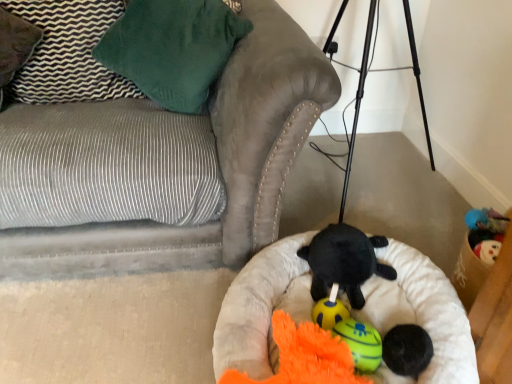
What do you see at coordinates (344, 261) in the screenshot? I see `black plush turtle at center, which is the 2th toy from back to front` at bounding box center [344, 261].

What do you see at coordinates (329, 310) in the screenshot?
I see `rubber ball at center, arranged as the first toy when viewed from the back` at bounding box center [329, 310].

Consider the image. Measure the distance between point (57, 141) and camera.

4.01 feet.

Where is `orange fuzzy toy at center, arranged as the 5th toy when viewed from the back`? Image resolution: width=512 pixels, height=384 pixels. orange fuzzy toy at center, arranged as the 5th toy when viewed from the back is located at coordinates (304, 357).

Locate an element on the screen. soft black ball at center, which is the 4th toy from back to front is located at coordinates (407, 349).

How much distance is there between green soft pillow at upper left, which appears as the first pillow when viewed from the right, and orange plush toy at center, the 3th toy in the front-to-back sequence?

They are 1.01 meters apart.

Which object is positioned more to the left, green soft pillow at upper left, which appears as the first pillow when viewed from the right, or orange plush toy at center, the 3th toy in the front-to-back sequence?

Positioned to the left is green soft pillow at upper left, which appears as the first pillow when viewed from the right.

Does green soft pillow at upper left, which appears as the 2th pillow when viewed from the left, contain orange plush toy at center, placed as the 3th toy when sorted from back to front?

No.

Considering the relative sizes of green soft pillow at upper left, which appears as the first pillow when viewed from the right, and orange plush toy at center, placed as the 3th toy when sorted from back to front, in the image provided, is green soft pillow at upper left, which appears as the first pillow when viewed from the right, taller than orange plush toy at center, placed as the 3th toy when sorted from back to front,?

Indeed, green soft pillow at upper left, which appears as the first pillow when viewed from the right, has a greater height compared to orange plush toy at center, placed as the 3th toy when sorted from back to front.

Does rubber ball at center, arranged as the first toy when viewed from the back, come behind soft black ball at center, which is the 4th toy from back to front?

Yes, rubber ball at center, arranged as the first toy when viewed from the back, is further from the camera.

Which is correct: rubber ball at center, arranged as the first toy when viewed from the back, is inside soft black ball at center, the 2th toy when ordered from front to back, or outside of it?

rubber ball at center, arranged as the first toy when viewed from the back, is outside soft black ball at center, the 2th toy when ordered from front to back.

Can you confirm if rubber ball at center, arranged as the first toy when viewed from the back, is shorter than soft black ball at center, the 2th toy when ordered from front to back?

Correct, rubber ball at center, arranged as the first toy when viewed from the back, is not as tall as soft black ball at center, the 2th toy when ordered from front to back.

From the image's perspective, which one is positioned lower, rubber ball at center, which appears as the fifth toy when viewed from the front, or soft black ball at center, which is the 4th toy from back to front?

soft black ball at center, which is the 4th toy from back to front, is shown below in the image.

Is point (37, 58) closer to camera compared to point (294, 336)?

No, (37, 58) is behind (294, 336).

Which of these two, velvet green pillow at upper left, placed as the 2th pillow when sorted from right to left, or orange fuzzy toy at center, the first toy in the front-to-back sequence, is bigger?

velvet green pillow at upper left, placed as the 2th pillow when sorted from right to left, is bigger.

Do you think velvet green pillow at upper left, which is the first pillow in left-to-right order, is within orange fuzzy toy at center, the first toy in the front-to-back sequence, or outside of it?

velvet green pillow at upper left, which is the first pillow in left-to-right order, lies outside orange fuzzy toy at center, the first toy in the front-to-back sequence.

From a real-world perspective, which is physically below, orange fuzzy toy at center, arranged as the 5th toy when viewed from the back, or velvet green pillow at upper left, placed as the 2th pillow when sorted from right to left?

In real-world perspective, orange fuzzy toy at center, arranged as the 5th toy when viewed from the back, is lower.

Considering the sizes of orange fuzzy toy at center, the first toy in the front-to-back sequence, and velvet green pillow at upper left, placed as the 2th pillow when sorted from right to left, in the image, is orange fuzzy toy at center, the first toy in the front-to-back sequence, bigger or smaller than velvet green pillow at upper left, placed as the 2th pillow when sorted from right to left,?

In the image, orange fuzzy toy at center, the first toy in the front-to-back sequence, appears to be smaller than velvet green pillow at upper left, placed as the 2th pillow when sorted from right to left.

Considering the relative positions of orange fuzzy toy at center, arranged as the 5th toy when viewed from the back, and velvet green pillow at upper left, placed as the 2th pillow when sorted from right to left, in the image provided, is orange fuzzy toy at center, arranged as the 5th toy when viewed from the back, to the left of velvet green pillow at upper left, placed as the 2th pillow when sorted from right to left, from the viewer's perspective?

No.

Based on the photo, who is taller, orange fuzzy toy at center, arranged as the 5th toy when viewed from the back, or velvet green pillow at upper left, which is the first pillow in left-to-right order?

Standing taller between the two is velvet green pillow at upper left, which is the first pillow in left-to-right order.

Could you tell me if soft beige dog bed at center is facing orange fuzzy toy at center, arranged as the 5th toy when viewed from the back?

Yes, soft beige dog bed at center is turned towards orange fuzzy toy at center, arranged as the 5th toy when viewed from the back.

Can you confirm if soft beige dog bed at center is shorter than orange fuzzy toy at center, the first toy in the front-to-back sequence?

No, soft beige dog bed at center is not shorter than orange fuzzy toy at center, the first toy in the front-to-back sequence.

Is soft beige dog bed at center wider than orange fuzzy toy at center, arranged as the 5th toy when viewed from the back?

Correct, the width of soft beige dog bed at center exceeds that of orange fuzzy toy at center, arranged as the 5th toy when viewed from the back.

Considering the relative sizes of green soft pillow at upper left, which appears as the 2th pillow when viewed from the left, and orange fuzzy toy at center, the first toy in the front-to-back sequence, in the image provided, is green soft pillow at upper left, which appears as the 2th pillow when viewed from the left, taller than orange fuzzy toy at center, the first toy in the front-to-back sequence,?

Indeed, green soft pillow at upper left, which appears as the 2th pillow when viewed from the left, has a greater height compared to orange fuzzy toy at center, the first toy in the front-to-back sequence.

Which object is wider, green soft pillow at upper left, which appears as the first pillow when viewed from the right, or orange fuzzy toy at center, the first toy in the front-to-back sequence?

green soft pillow at upper left, which appears as the first pillow when viewed from the right.

From the image's perspective, who appears lower, green soft pillow at upper left, which appears as the first pillow when viewed from the right, or orange fuzzy toy at center, arranged as the 5th toy when viewed from the back?

From the image's view, orange fuzzy toy at center, arranged as the 5th toy when viewed from the back, is below.

Is green soft pillow at upper left, which appears as the first pillow when viewed from the right, oriented towards orange fuzzy toy at center, the first toy in the front-to-back sequence?

No, green soft pillow at upper left, which appears as the first pillow when viewed from the right, is not aimed at orange fuzzy toy at center, the first toy in the front-to-back sequence.

Between black plush turtle at center, which is the 2th toy from back to front, and soft beige dog bed at center, which one has larger width?

Wider between the two is soft beige dog bed at center.

From a real-world perspective, is black plush turtle at center, positioned as the fourth toy in front-to-back order, on top of soft beige dog bed at center?

Yes.

Considering the points (370, 260) and (277, 250), which point is behind, point (370, 260) or point (277, 250)?

The point (277, 250) is farther from the camera.

Find the location of a particular element. The width and height of the screenshot is (512, 384). the 4th toy below when counting from the green soft pillow at upper left, which appears as the first pillow when viewed from the right (from the image's perspective) is located at coordinates (361, 343).

This screenshot has height=384, width=512. What are the coordinates of `the 1st toy above the soft black ball at center, which is the 4th toy from back to front (from the image's perspective)` in the screenshot? It's located at (329, 310).

Considering their positions, is orange plush toy at center, placed as the 3th toy when sorted from back to front, positioned further to suede gray couch at lower left than green soft pillow at upper left, which appears as the first pillow when viewed from the right?

orange plush toy at center, placed as the 3th toy when sorted from back to front.

Looking at the image, which one is located further to orange plush toy at center, the 3th toy in the front-to-back sequence, rubber ball at center, which appears as the fifth toy when viewed from the front, or suede gray couch at lower left?

suede gray couch at lower left.

Estimate the real-world distances between objects in this image. Which object is further from rubber ball at center, arranged as the first toy when viewed from the back, velvet green pillow at upper left, placed as the 2th pillow when sorted from right to left, or soft black ball at center, which is the 4th toy from back to front?

velvet green pillow at upper left, placed as the 2th pillow when sorted from right to left.

Based on their spatial positions, is black plush turtle at center, which is the 2th toy from back to front, or soft beige dog bed at center further from orange fuzzy toy at center, arranged as the 5th toy when viewed from the back?

black plush turtle at center, which is the 2th toy from back to front, is positioned further to the anchor orange fuzzy toy at center, arranged as the 5th toy when viewed from the back.

Estimate the real-world distances between objects in this image. Which object is closer to rubber ball at center, arranged as the first toy when viewed from the back, velvet green pillow at upper left, which is the first pillow in left-to-right order, or green soft pillow at upper left, which appears as the first pillow when viewed from the right?

green soft pillow at upper left, which appears as the first pillow when viewed from the right, is closer to rubber ball at center, arranged as the first toy when viewed from the back.

Based on their spatial positions, is orange fuzzy toy at center, arranged as the 5th toy when viewed from the back, or soft beige dog bed at center further from orange plush toy at center, placed as the 3th toy when sorted from back to front?

soft beige dog bed at center.

From the picture: When comparing their distances from rubber ball at center, which appears as the fifth toy when viewed from the front, does black plush turtle at center, which is the 2th toy from back to front, or orange fuzzy toy at center, the first toy in the front-to-back sequence, seem further?

orange fuzzy toy at center, the first toy in the front-to-back sequence, is positioned further to the anchor rubber ball at center, which appears as the fifth toy when viewed from the front.

Looking at the image, which one is located closer to black plush turtle at center, positioned as the fourth toy in front-to-back order, soft beige dog bed at center or soft black ball at center, the 2th toy when ordered from front to back?

Based on the image, soft beige dog bed at center appears to be nearer to black plush turtle at center, positioned as the fourth toy in front-to-back order.

Where is `pillow between suede gray couch at lower left and velvet green pillow at upper left, which is the first pillow in left-to-right order, along the z-axis`? This screenshot has width=512, height=384. pillow between suede gray couch at lower left and velvet green pillow at upper left, which is the first pillow in left-to-right order, along the z-axis is located at coordinates (172, 48).

The image size is (512, 384). In order to click on studio couch between velvet green pillow at upper left, placed as the 2th pillow when sorted from right to left, and rubber ball at center, which appears as the fifth toy when viewed from the front in this screenshot , I will do `click(164, 163)`.

The image size is (512, 384). Find the location of `dog bed between velvet green pillow at upper left, which is the first pillow in left-to-right order, and orange fuzzy toy at center, arranged as the 5th toy when viewed from the back, from top to bottom`. dog bed between velvet green pillow at upper left, which is the first pillow in left-to-right order, and orange fuzzy toy at center, arranged as the 5th toy when viewed from the back, from top to bottom is located at coordinates (420, 315).

Locate an element on the screen. This screenshot has height=384, width=512. dog bed between green soft pillow at upper left, which appears as the first pillow when viewed from the right, and orange plush toy at center, placed as the 3th toy when sorted from back to front, in the vertical direction is located at coordinates (420, 315).